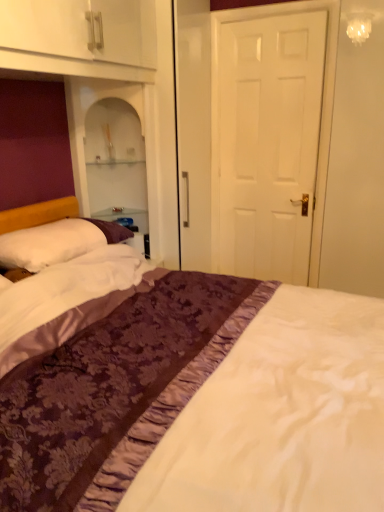
Question: Can you confirm if purple satin bed at center is wider than white matte door at center?

Choices:
 (A) no
 (B) yes

Answer: (B)

Question: Does purple satin bed at center have a smaller size compared to white matte door at center?

Choices:
 (A) no
 (B) yes

Answer: (A)

Question: Does purple satin bed at center come behind white matte door at center?

Choices:
 (A) yes
 (B) no

Answer: (B)

Question: Is purple satin bed at center outside white matte door at center?

Choices:
 (A) yes
 (B) no

Answer: (A)

Question: From the image's perspective, does purple satin bed at center appear lower than white matte door at center?

Choices:
 (A) no
 (B) yes

Answer: (B)

Question: In terms of height, does white soft pillow at left look taller or shorter compared to purple satin bed at center?

Choices:
 (A) tall
 (B) short

Answer: (B)

Question: Looking at the image, does white soft pillow at left seem bigger or smaller compared to purple satin bed at center?

Choices:
 (A) small
 (B) big

Answer: (A)

Question: Is point (49, 232) closer or farther from the camera than point (231, 370)?

Choices:
 (A) closer
 (B) farther

Answer: (B)

Question: Looking at their shapes, would you say white soft pillow at left is wider or thinner than purple satin bed at center?

Choices:
 (A) wide
 (B) thin

Answer: (B)

Question: Is white matte door at center situated inside purple satin bed at center or outside?

Choices:
 (A) outside
 (B) inside

Answer: (A)

Question: Is white matte door at center to the left or to the right of purple satin bed at center in the image?

Choices:
 (A) right
 (B) left

Answer: (A)

Question: From a real-world perspective, is white matte door at center above or below purple satin bed at center?

Choices:
 (A) above
 (B) below

Answer: (A)

Question: From the image's perspective, is white matte door at center located above or below purple satin bed at center?

Choices:
 (A) below
 (B) above

Answer: (B)

Question: In terms of size, does white soft pillow at left appear bigger or smaller than white matte door at center?

Choices:
 (A) small
 (B) big

Answer: (A)

Question: From a real-world perspective, is white soft pillow at left physically located above or below white matte door at center?

Choices:
 (A) below
 (B) above

Answer: (A)